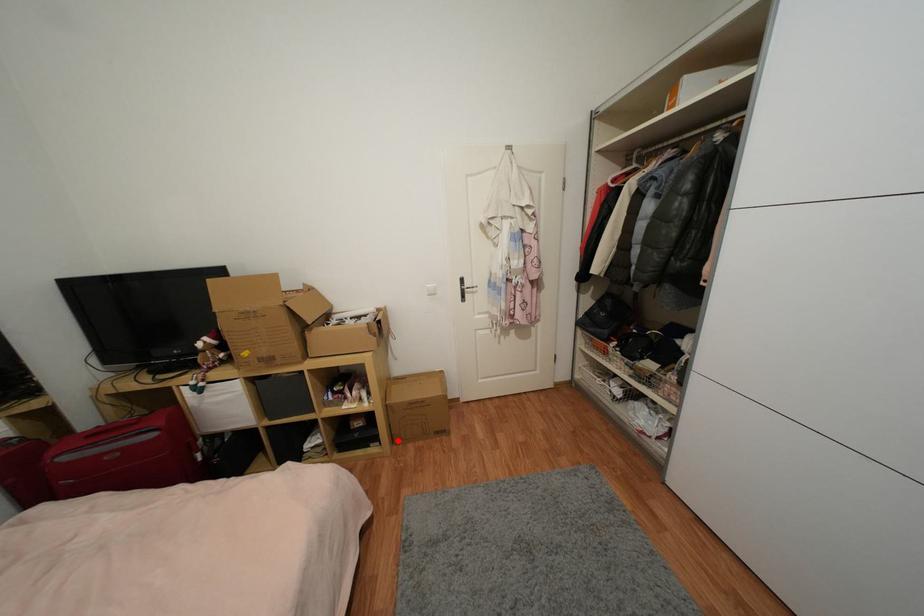
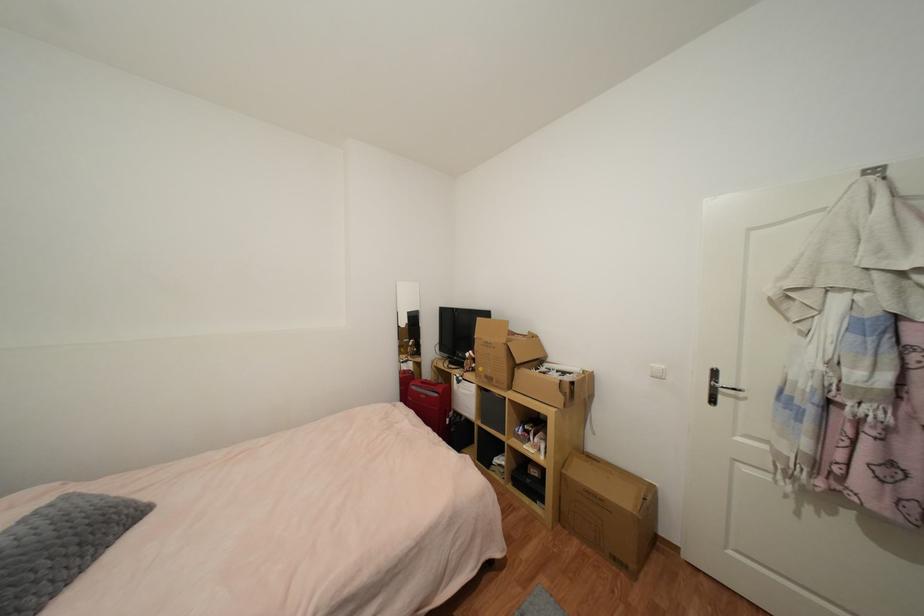
Where in the second image is the point corresponding to the highlighted location from the first image?

(564, 517)